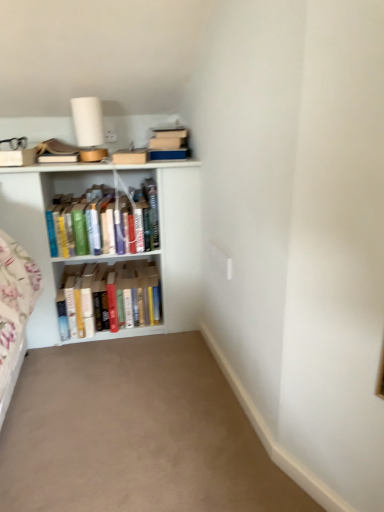
Question: Considering the positions of point (99, 225) and point (48, 300), is point (99, 225) closer or farther from the camera than point (48, 300)?

Choices:
 (A) farther
 (B) closer

Answer: (B)

Question: Is hardcover books at center, arranged as the first book when viewed from the top, inside the boundaries of white wooden bookshelf at left, or outside?

Choices:
 (A) inside
 (B) outside

Answer: (A)

Question: Which is nearer to the hardcover books at center, which appears as the first book when ordered from the bottom?

Choices:
 (A) hardcover books at center, which is counted as the 2th book, starting from the bottom
 (B) white wooden bookshelf at left
 (C) beige carpet at lower center

Answer: (B)

Question: Considering the real-world distances, which object is farthest from the hardcover books at center, arranged as the first book when viewed from the top?

Choices:
 (A) hardcover books at center, which is the 2th book from top to bottom
 (B) white wooden bookshelf at left
 (C) beige carpet at lower center

Answer: (C)